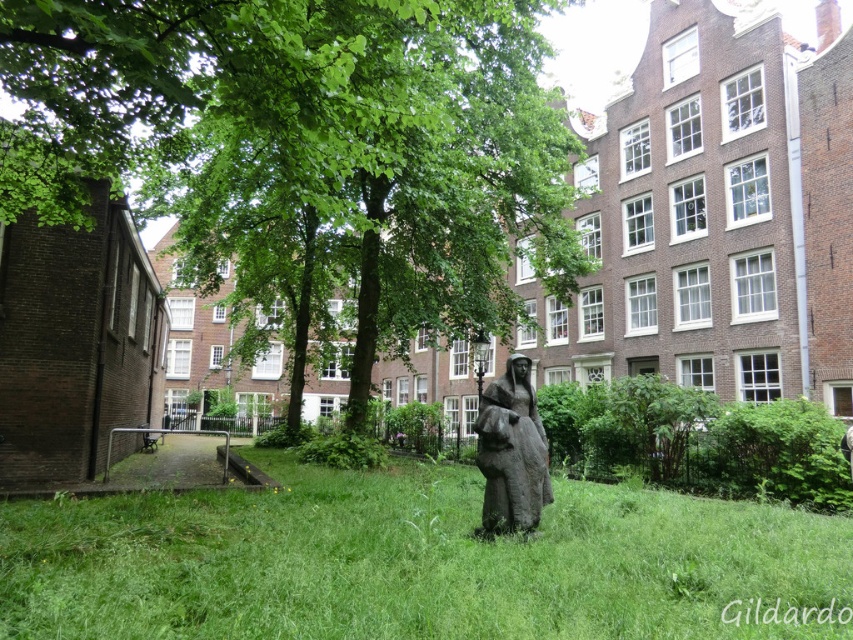
You are a gardener who needs to water the green leafy tree at center and the green grassy at center. You have a water hose that can reach 5 meters. Can you water both without moving the hose? Please explain your reasoning.

The green leafy tree at center is 5.61 meters away from green grassy at center. Since the hose can only reach 5 meters, you cannot water both without moving the hose because the distance between them exceeds the hose length.

You are a gardener who needs to water the green leafy tree at center and the green grassy at center. Since you can only water one area at a time, which one is closer to you so you can start there?

The green leafy tree at center is closer to you because the green grassy at center is behind it.

You are a city planner reviewing this park layout. You need to determine if the bronze statue at center can be moved closer to the green leafy tree at center without removing the tree. Based on their sizes, is this feasible?

The green leafy tree at center is bigger than the bronze statue at center. Since the tree is larger, there is sufficient space around it to accommodate moving the statue closer without needing to remove the tree.